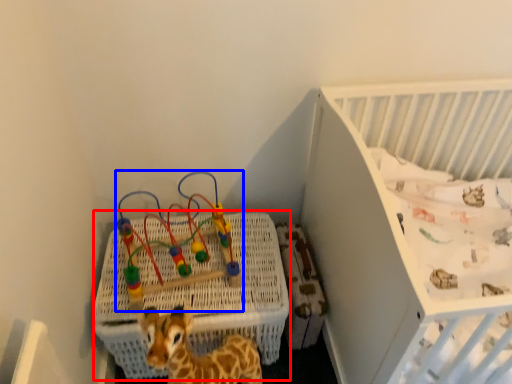
Question: Which point is further to the camera, crate (highlighted by a red box) or toy (highlighted by a blue box)?

Choices:
 (A) crate
 (B) toy

Answer: (A)